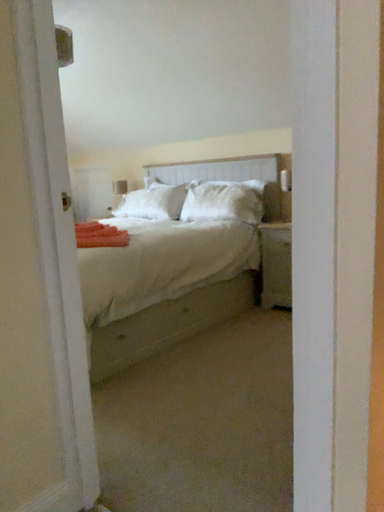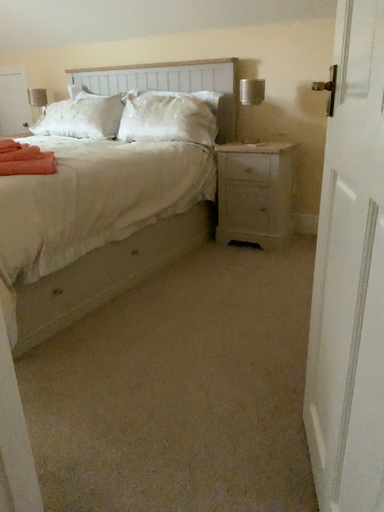
Question: Which way did the camera rotate in the video?

Choices:
 (A) rotated left
 (B) rotated right

Answer: (B)